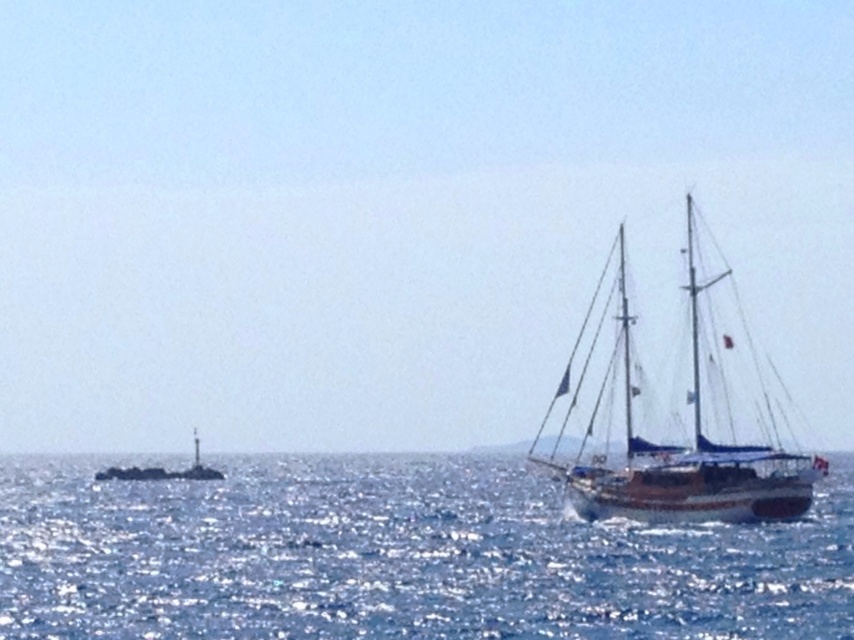
You are standing on a cliff overlooking the sea and see the blue water at lower right and the wooden sailboat at right. Which object appears taller from your perspective?

The wooden sailboat at right appears taller than the blue water at lower right because the blue water at lower right has a lesser height compared to the wooden sailboat at right.

Based on the photo, you are a sailor trying to navigate between the wooden sailboat at right and the white plastic buoy at left. Which object has a narrower width?

The wooden sailboat at right is thinner than the white plastic buoy at left, so the wooden sailboat at right has a narrower width.

You are standing on the deck of the sailboat and want to take a photo of two points in the scene. The first point is at coordinates point (56,532) and the second is at point (192,477). Which point will appear larger in your photo?

Point (56,532) will appear larger in the photo because it is closer to the camera than point (192,477).